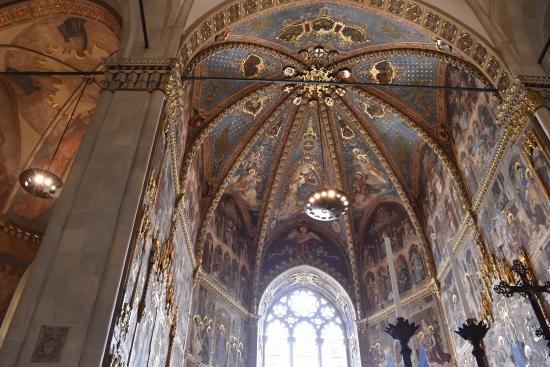
Locate an element on the screen. tile is located at coordinates (104, 169).